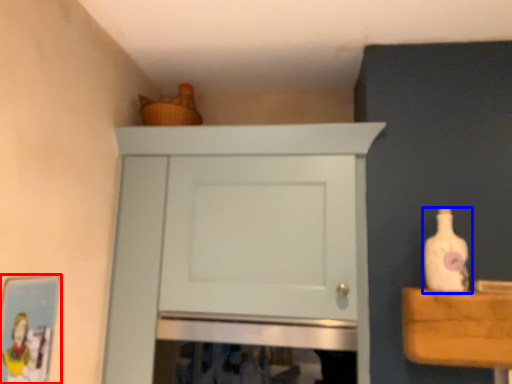
Question: Which object appears farthest to the camera in this image, picture frame (highlighted by a red box) or bottle (highlighted by a blue box)?

Choices:
 (A) picture frame
 (B) bottle

Answer: (B)